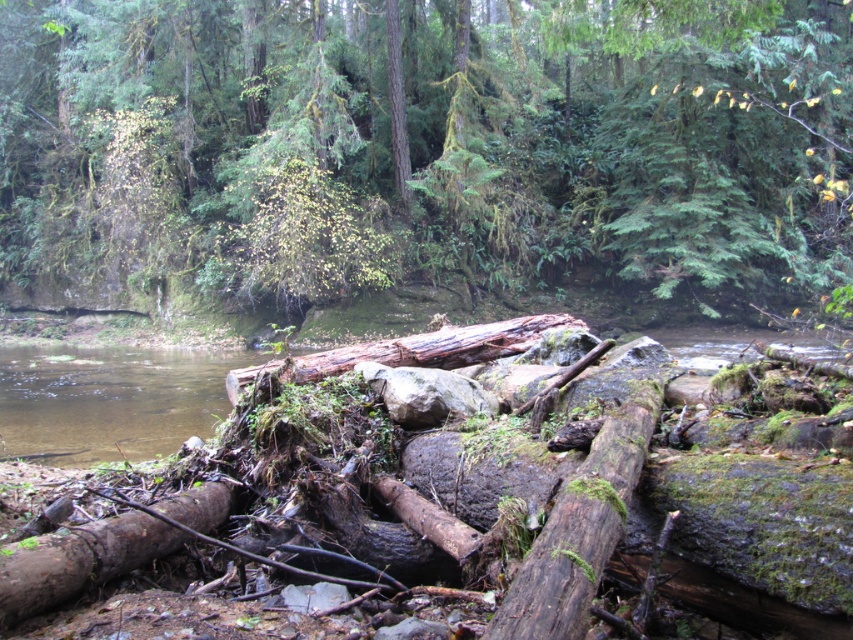
You are a hiker trying to cross the stream using the logs provided. The green mossy log at center and the brown rough log at lower left are both available. Which log is wider and more stable to step on?

The green mossy log at center is wider than the brown rough log at lower left, making it more stable to step on.